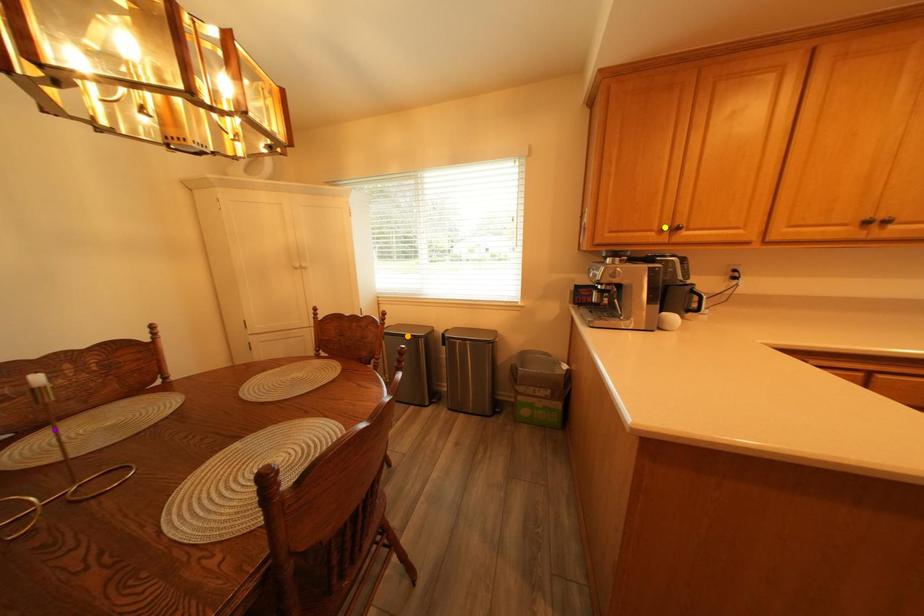
Order these from nearest to farthest:
purple point | orange point | yellow point

1. purple point
2. yellow point
3. orange point